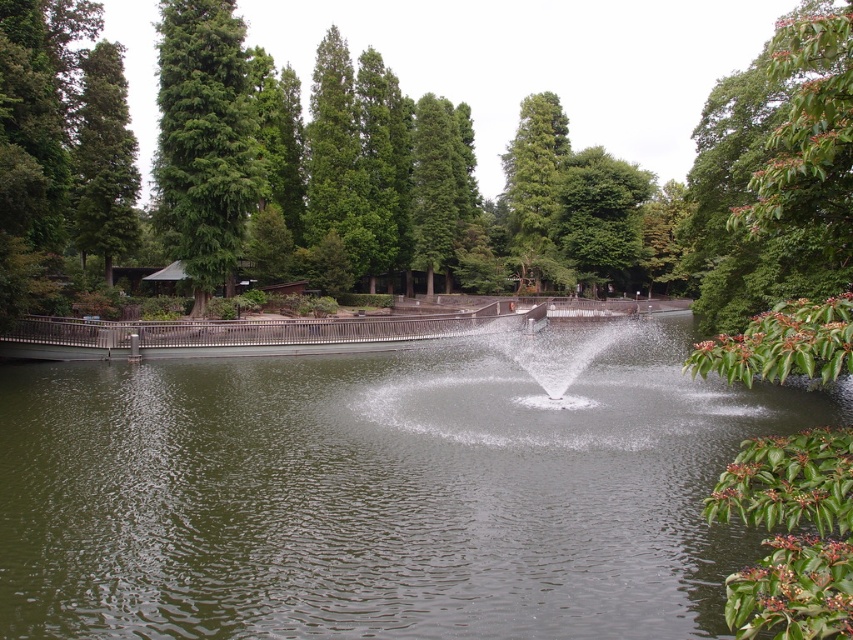
Question: Does green matte tree at upper left appear on the left side of green leafy tree at upper center?

Choices:
 (A) yes
 (B) no

Answer: (A)

Question: Which object is the farthest from the green matte tree at left?

Choices:
 (A) green matte tree at upper center
 (B) green matte tree at upper left
 (C) green leafy tree at upper center

Answer: (C)

Question: Which point appears closest to the camera in this image?

Choices:
 (A) (648, 342)
 (B) (170, 44)
 (C) (78, 237)
 (D) (519, 140)

Answer: (B)

Question: Does green matte tree at upper left appear on the right side of green leafy tree at upper center?

Choices:
 (A) yes
 (B) no

Answer: (B)

Question: Which point is closer to the camera?

Choices:
 (A) (549, 275)
 (B) (605, 156)
 (C) (184, 8)
 (D) (596, 600)

Answer: (D)

Question: Is green matte tree at upper left bigger than green matte tree at upper center?

Choices:
 (A) no
 (B) yes

Answer: (A)